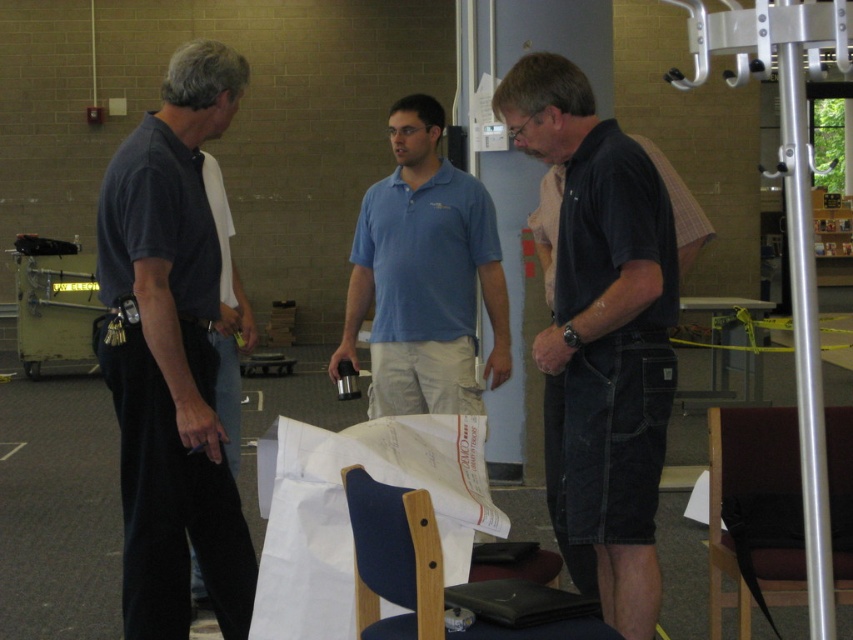
Question: Which object appears farthest from the camera in this image?

Choices:
 (A) blue cotton polo shirt at center
 (B) dark blue jeans at left
 (C) blue fabric chair at lower center
 (D) dark blue shirt at left

Answer: (A)

Question: Among these objects, which one is nearest to the camera?

Choices:
 (A) dark blue shirt at left
 (B) dark blue jeans at left
 (C) black cotton shirt at center
 (D) maroon fabric chair at center

Answer: (C)

Question: Among these objects, which one is nearest to the camera?

Choices:
 (A) black cotton shirt at center
 (B) dark blue shirt at left
 (C) blue cotton polo shirt at center
 (D) maroon fabric chair at center

Answer: (A)

Question: Does dark blue shirt at left lie in front of blue fabric chair at lower center?

Choices:
 (A) no
 (B) yes

Answer: (A)

Question: Is blue cotton polo shirt at center above maroon fabric chair at center?

Choices:
 (A) no
 (B) yes

Answer: (B)

Question: Considering the relative positions of black cotton shirt at center and blue fabric chair at lower center in the image provided, where is black cotton shirt at center located with respect to blue fabric chair at lower center?

Choices:
 (A) above
 (B) below

Answer: (A)